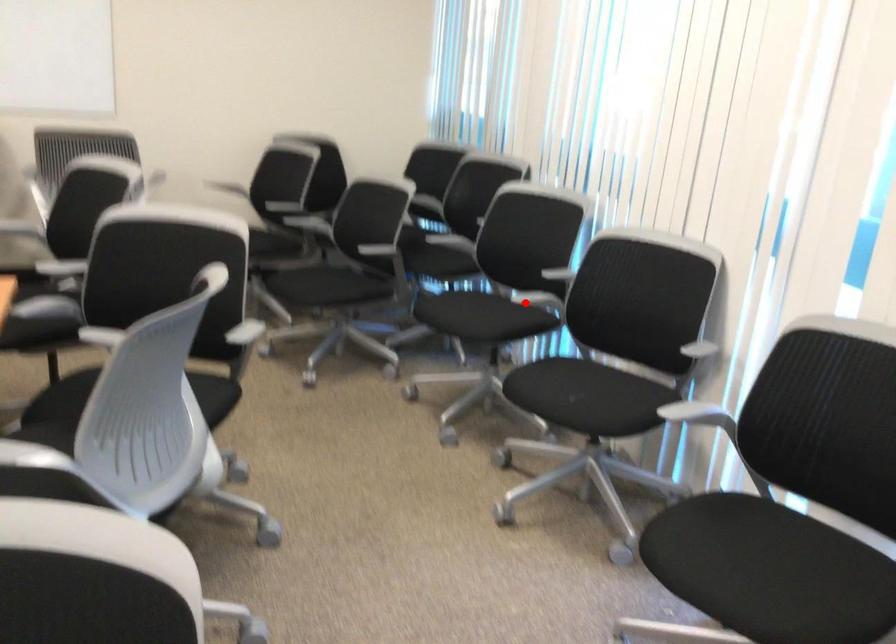
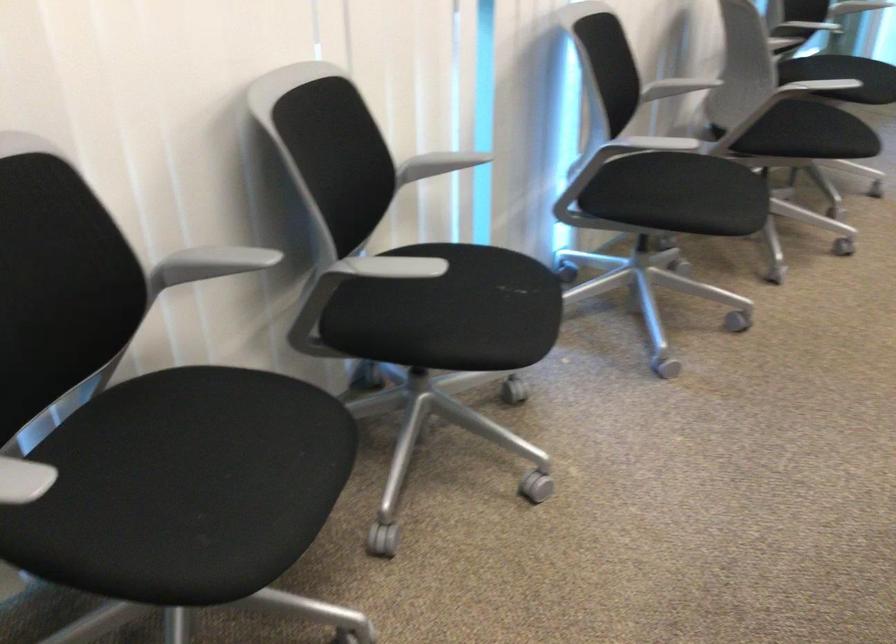
Find the pixel in the second image that matches the highlighted location in the first image.

(384, 267)